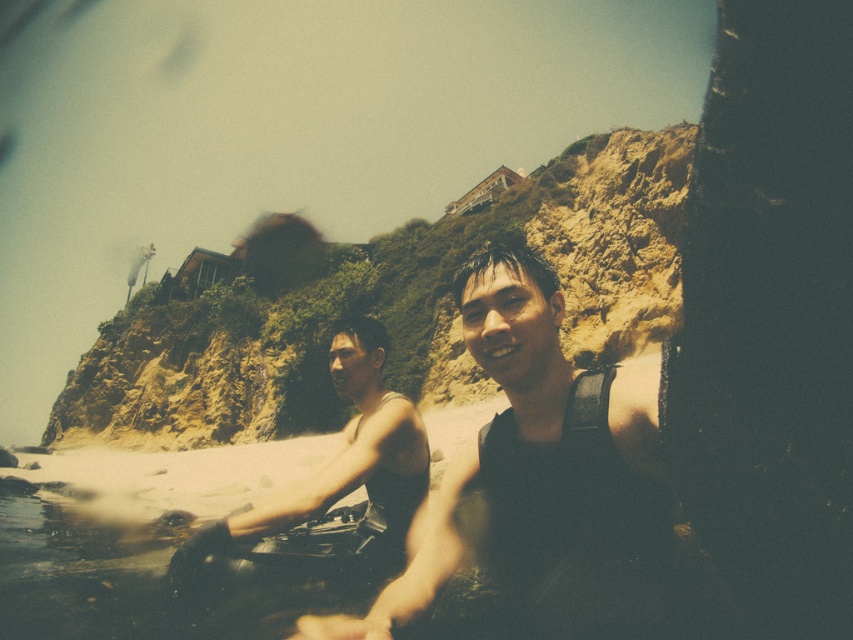
Question: Is dark gray wetsuit at center bigger than matte black wetsuit at center?

Choices:
 (A) yes
 (B) no

Answer: (A)

Question: Considering the relative positions of dark gray wetsuit at center and matte black wetsuit at center in the image provided, where is dark gray wetsuit at center located with respect to matte black wetsuit at center?

Choices:
 (A) left
 (B) right

Answer: (B)

Question: Among these objects, which one is nearest to the camera?

Choices:
 (A) matte black wetsuit at center
 (B) dark gray wetsuit at center

Answer: (B)

Question: Which point is farther to the camera?

Choices:
 (A) (335, 460)
 (B) (523, 410)

Answer: (A)

Question: Can you confirm if dark gray wetsuit at center is thinner than matte black wetsuit at center?

Choices:
 (A) no
 (B) yes

Answer: (A)